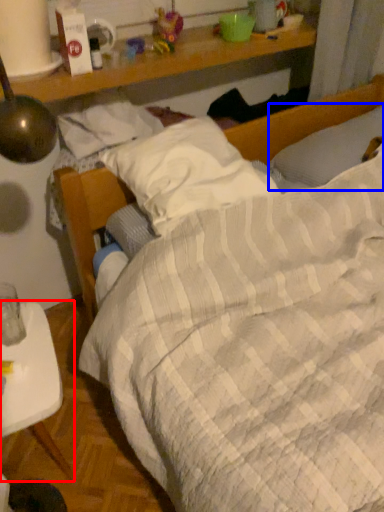
Question: Among these objects, which one is nearest to the camera, desk (highlighted by a red box) or pillow (highlighted by a blue box)?

Choices:
 (A) desk
 (B) pillow

Answer: (A)